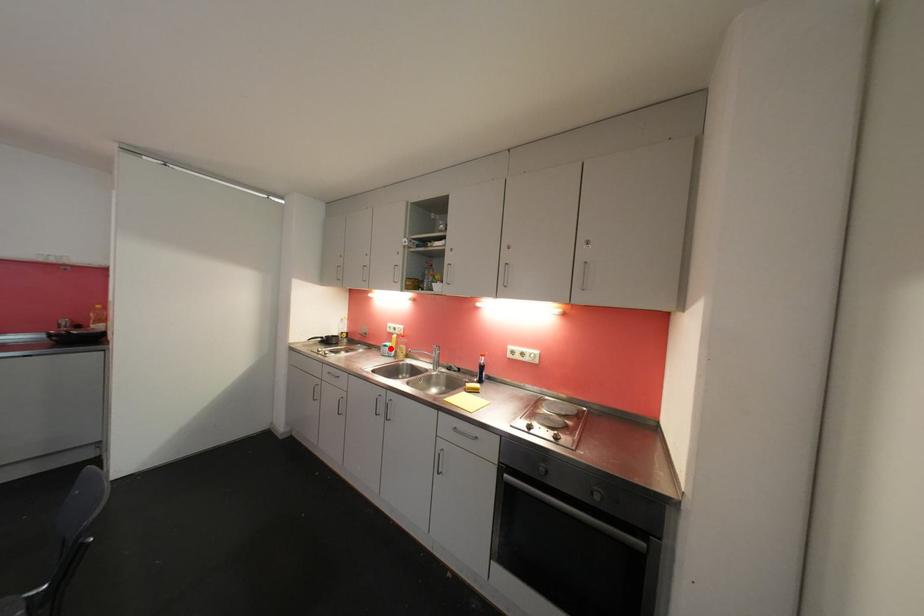
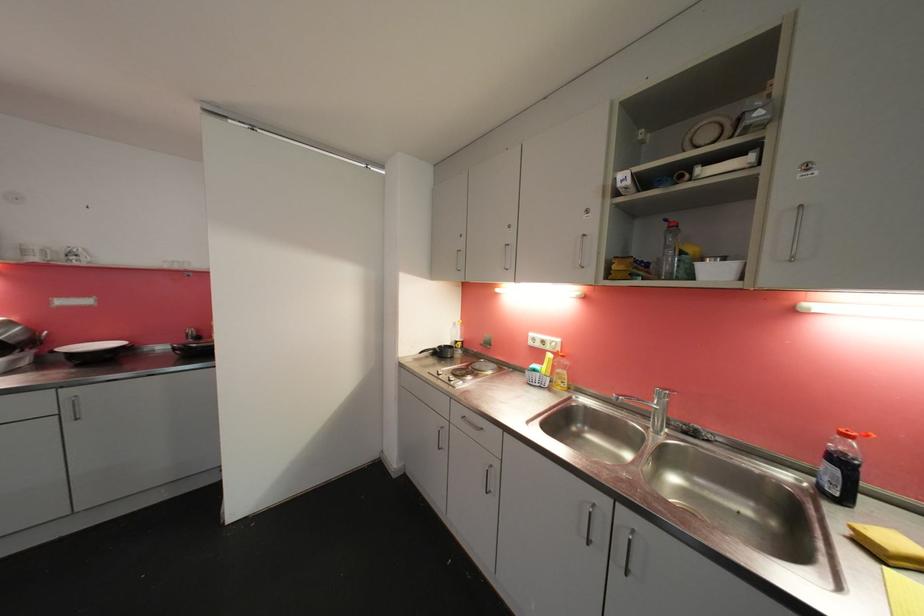
In the second image, find the point that corresponds to the highlighted location in the first image.

(540, 373)